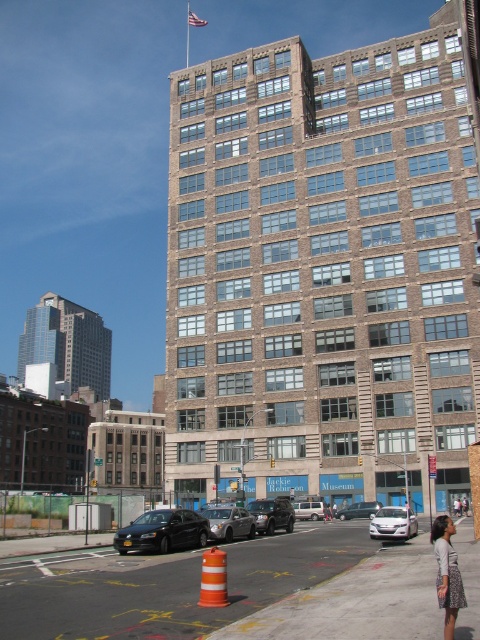
Looking at this image, is the position of glassy blue skyscraper at left less distant than that of shiny black sedan at lower left?

No.

Looking at this image, can you confirm if glassy blue skyscraper at left is shorter than shiny black sedan at lower left?

Incorrect, glassy blue skyscraper at left's height does not fall short of shiny black sedan at lower left's.

Is point (64, 314) positioned in front of point (126, 541)?

No.

Where is `glassy blue skyscraper at left`? This screenshot has height=640, width=480. glassy blue skyscraper at left is located at coordinates (x=68, y=342).

Is satin silver sedan at lower center smaller than shiny black suv at center?

Actually, satin silver sedan at lower center might be larger than shiny black suv at center.

Between satin silver sedan at lower center and shiny black suv at center, which one is positioned lower?

Positioned lower is shiny black suv at center.

Where is `satin silver sedan at lower center`? The height and width of the screenshot is (640, 480). satin silver sedan at lower center is located at coordinates (393, 524).

Is brown brick building at center below silver metallic sedan at center?

No, brown brick building at center is not below silver metallic sedan at center.

Describe the element at coordinates (323, 273) in the screenshot. I see `brown brick building at center` at that location.

You are a GUI agent. You are given a task and a screenshot of the screen. Output one action in this format:
    pyautogui.click(x=<x>, y=<y>)
    Task: Click on the brown brick building at center
    The height and width of the screenshot is (640, 480).
    Given the screenshot: What is the action you would take?
    pyautogui.click(x=323, y=273)

Find the location of a particular element. This screenshot has height=640, width=480. brown brick building at center is located at coordinates (323, 273).